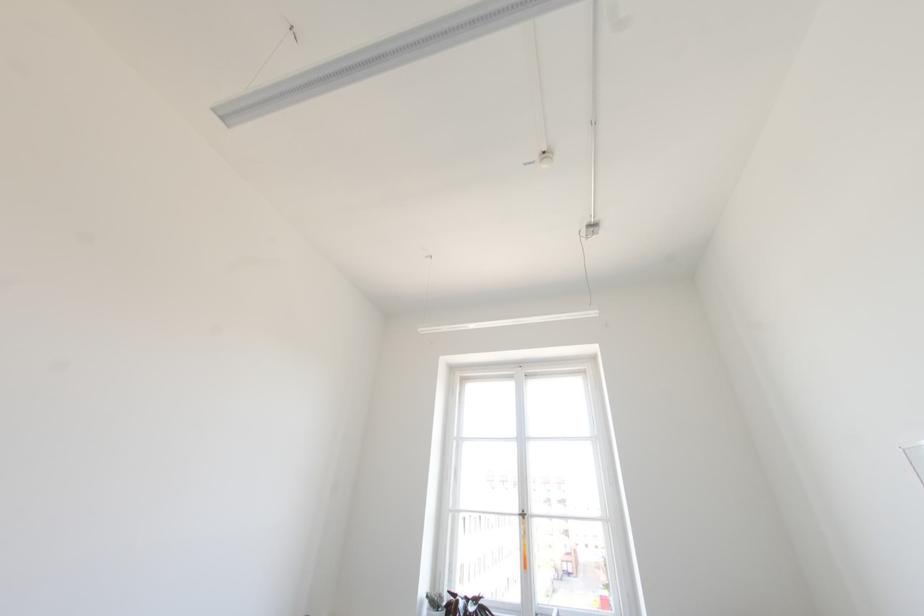
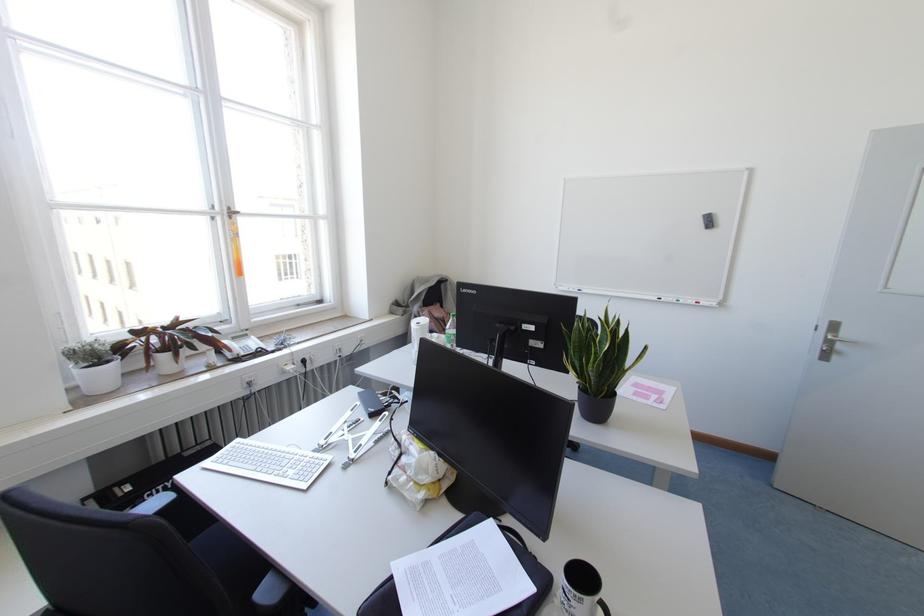
Find the pixel in the second image that matches point 523,517 in the first image.

(229, 217)